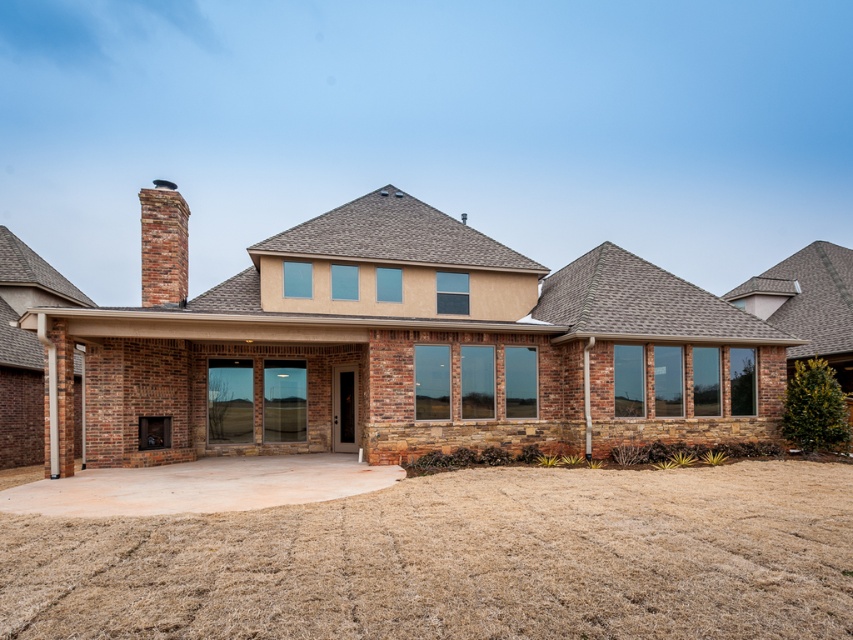
You are standing in front of the house and notice a point marked at coordinates (459, 561). What material is located at that point?

The point at coordinates (459, 561) corresponds to concrete at center.

You are standing in front of the house and notice the concrete at center and the brick chimney at upper left. Which of these two objects is positioned lower in the image?

The concrete at center is positioned lower than the brick chimney at upper left as it is located below it.

You are standing in front of the house and want to walk to the brick chimney at upper left. Which direction should you move first from the concrete at center?

The concrete at center is closer to the viewer than the brick chimney at upper left, so you should move towards the upper left direction to reach the brick chimney at upper left.